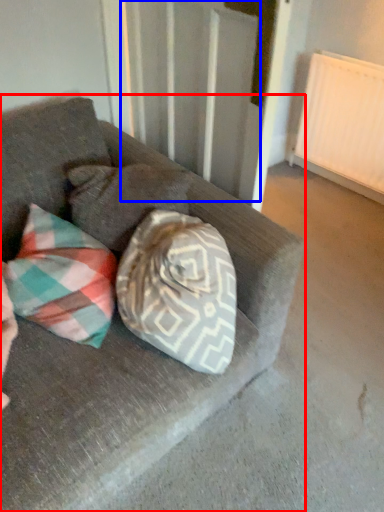
Question: Which object is further to the camera taking this photo, studio couch (highlighted by a red box) or curtain (highlighted by a blue box)?

Choices:
 (A) studio couch
 (B) curtain

Answer: (B)